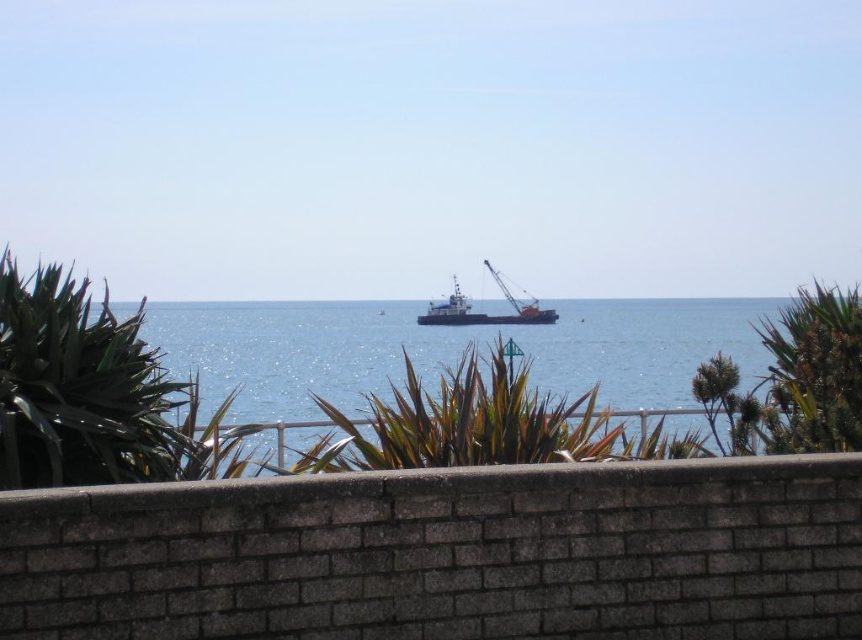
Question: Does blue water at center lie behind orange matte cargo ship at center?

Choices:
 (A) yes
 (B) no

Answer: (B)

Question: Which object is closer to the camera taking this photo?

Choices:
 (A) blue water at center
 (B) orange matte cargo ship at center

Answer: (A)

Question: Can you confirm if blue water at center is positioned above orange matte cargo ship at center?

Choices:
 (A) yes
 (B) no

Answer: (B)

Question: Which object appears closest to the camera in this image?

Choices:
 (A) orange matte cargo ship at center
 (B) blue water at center

Answer: (B)

Question: Where is blue water at center located in relation to orange matte cargo ship at center in the image?

Choices:
 (A) left
 (B) right

Answer: (A)